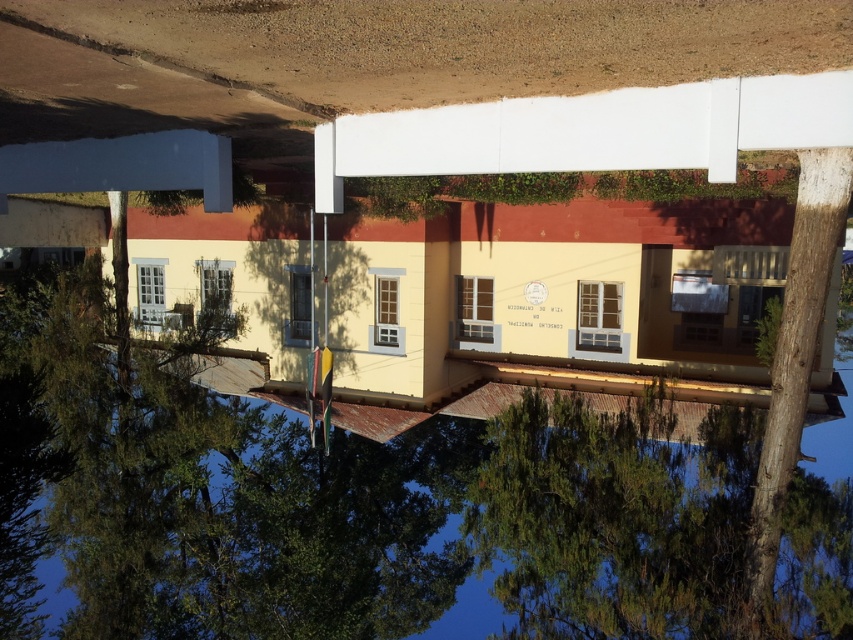
The width and height of the screenshot is (853, 640). What do you see at coordinates (373, 524) in the screenshot? I see `transparent plastic water at center` at bounding box center [373, 524].

Can you confirm if transparent plastic water at center is positioned to the right of smooth brown tree trunk at right?

Incorrect, transparent plastic water at center is not on the right side of smooth brown tree trunk at right.

Measure the distance between point (144, 598) and camera.

Point (144, 598) is 22.98 meters from camera.

The height and width of the screenshot is (640, 853). In order to click on transparent plastic water at center in this screenshot , I will do `click(373, 524)`.